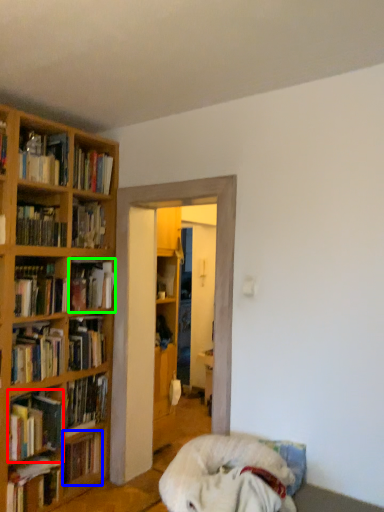
Question: Which object is the farthest from book (highlighted by a red box)? Choose among these: book (highlighted by a blue box) or book (highlighted by a green box).

Choices:
 (A) book
 (B) book

Answer: (B)